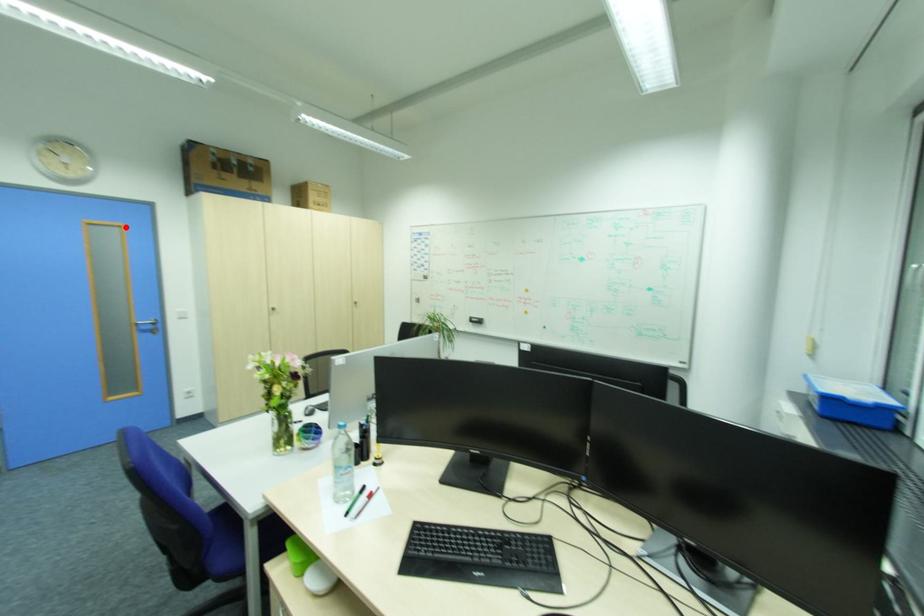
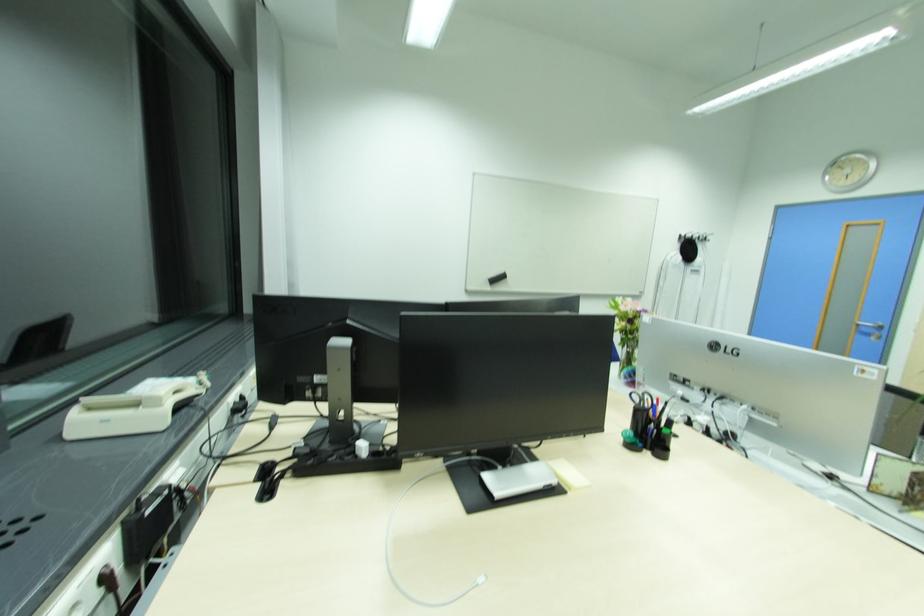
Question: I am providing you with two images of the same scene from different viewpoints. A red point is shown in image1. For the corresponding object point in image2, is it positioned nearer or farther from the camera?

Choices:
 (A) Nearer
 (B) Farther

Answer: (B)